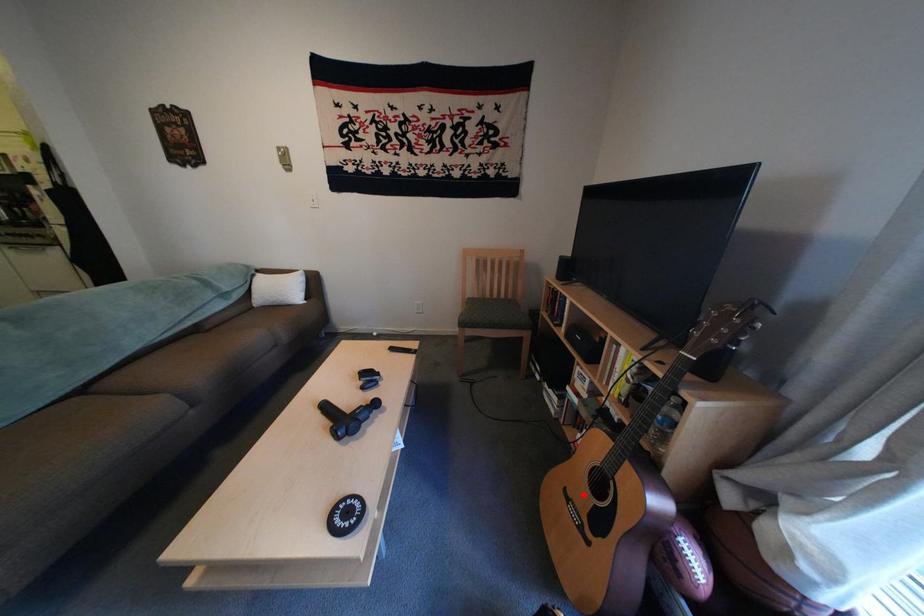
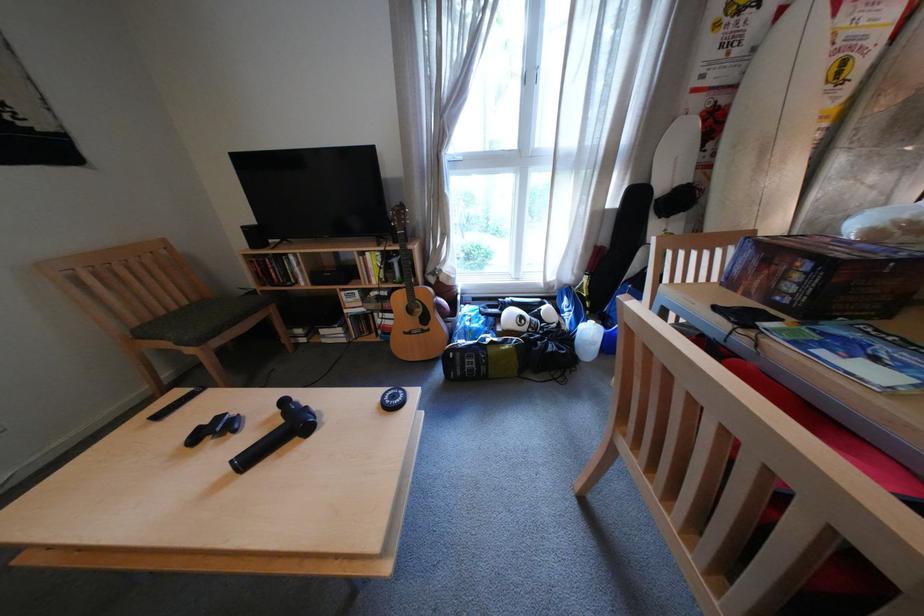
Locate, in the second image, the point that corresponds to the highlighted location in the first image.

(420, 331)